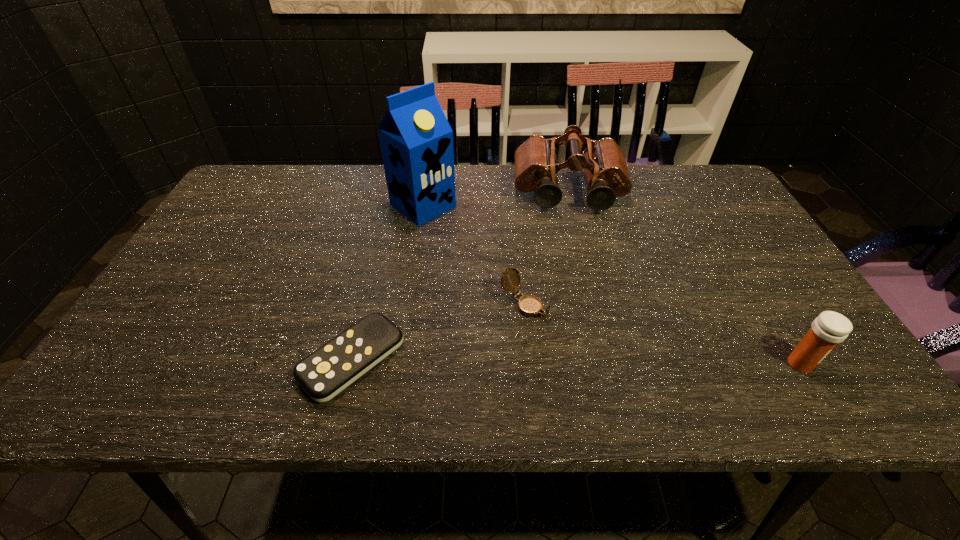
The width and height of the screenshot is (960, 540). Identify the location of free location located 0.070m on the face of the fourth tallest object. (569, 333).

Identify the location of blank area located through the eyepieces of the binoculars. (573, 230).

Identify the location of vacant position located through the eyepieces of the binoculars. This screenshot has width=960, height=540. (575, 247).

Find the location of a particular element. This screenshot has height=540, width=960. vacant space located through the eyepieces of the binoculars is located at coordinates (574, 242).

You are a GUI agent. You are given a task and a screenshot of the screen. Output one action in this format:
    pyautogui.click(x=<x>, y=<y>)
    Task: Click on the free spot located with the cap open on the tallest object
    This screenshot has height=540, width=960.
    Given the screenshot: What is the action you would take?
    pyautogui.click(x=539, y=288)

This screenshot has width=960, height=540. Find the location of `vacant space located with the cap open on the tallest object`. vacant space located with the cap open on the tallest object is located at coordinates (495, 258).

Find the location of a particular element. The height and width of the screenshot is (540, 960). vacant position located 0.300m with the cap open on the tallest object is located at coordinates (520, 275).

Where is `binoculars positioned at the far edge`? This screenshot has height=540, width=960. binoculars positioned at the far edge is located at coordinates (603, 161).

Find the location of a particular element. The image size is (960, 540). carton at the far edge is located at coordinates (416, 140).

You are a GUI agent. You are given a task and a screenshot of the screen. Output one action in this format:
    pyautogui.click(x=<x>, y=<y>)
    Task: Click on the remote control that is at the near edge
    The width and height of the screenshot is (960, 540).
    Given the screenshot: What is the action you would take?
    pyautogui.click(x=326, y=372)